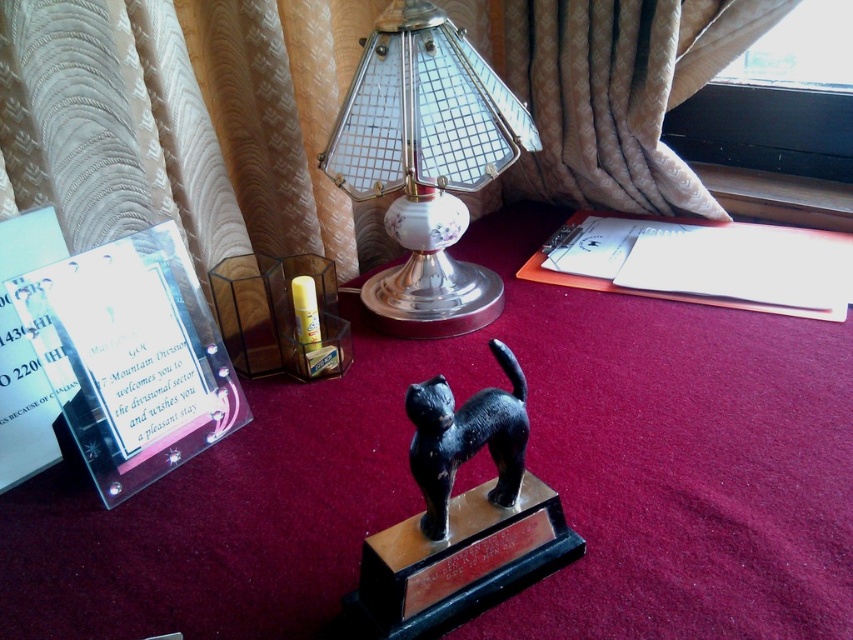
You are standing in a room and see both the metallic trophy at center and the black glossy cat at center. Which object is positioned to the right of the other?

The metallic trophy at center is to the right of the black glossy cat at center.

You are a guest in this room and want to place a small toy mouse on the carpet. If you put it between the metallic glass lampshade at center and the black glossy cat at center, will it fit without overlapping either object?

The metallic glass lampshade at center is larger in size than the black glossy cat at center. Since the toy mouse is small, placing it between them should be possible without overlapping either object, as there is sufficient space between the two items.